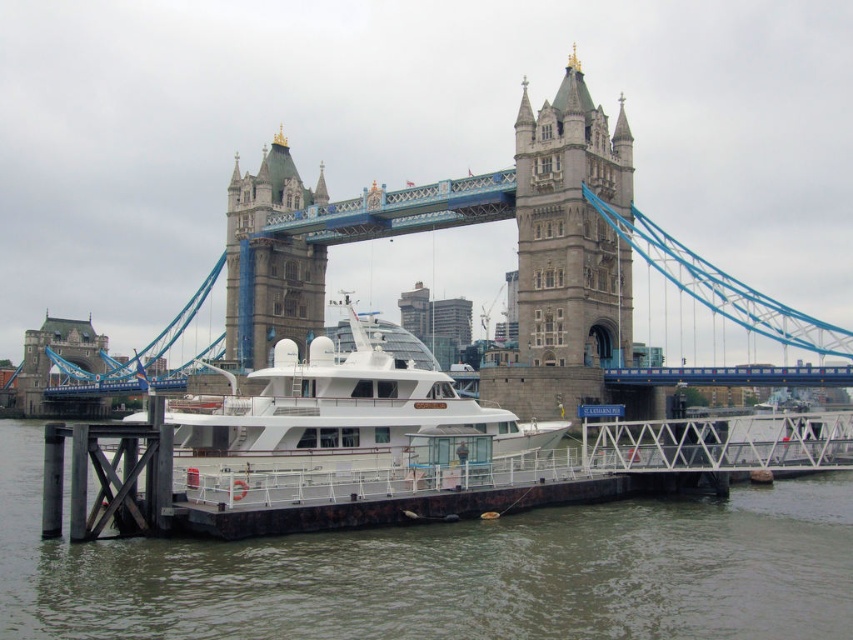
Who is positioned more to the left, brown water at lower center or stone stonework tower at upper center?

stone stonework tower at upper center is more to the left.

Between brown water at lower center and stone stonework tower at upper center, which one has more height?

With more height is stone stonework tower at upper center.

What are the coordinates of `brown water at lower center` in the screenshot? It's located at (448, 572).

Is stone tower at center in front of stone stonework tower at upper center?

That is True.

Does stone tower at center appear under stone stonework tower at upper center?

Incorrect, stone tower at center is not positioned below stone stonework tower at upper center.

The height and width of the screenshot is (640, 853). In order to click on stone tower at center in this screenshot , I will do `click(572, 228)`.

The image size is (853, 640). I want to click on stone tower at center, so click(x=572, y=228).

Does brown water at lower center have a lesser height compared to stone tower at center?

Indeed, brown water at lower center has a lesser height compared to stone tower at center.

Looking at this image, can you confirm if brown water at lower center is taller than stone tower at center?

In fact, brown water at lower center may be shorter than stone tower at center.

Which is behind, point (599, 634) or point (550, 177)?

The point (550, 177) is more distant.

Identify the location of brown water at lower center. The image size is (853, 640). (448, 572).